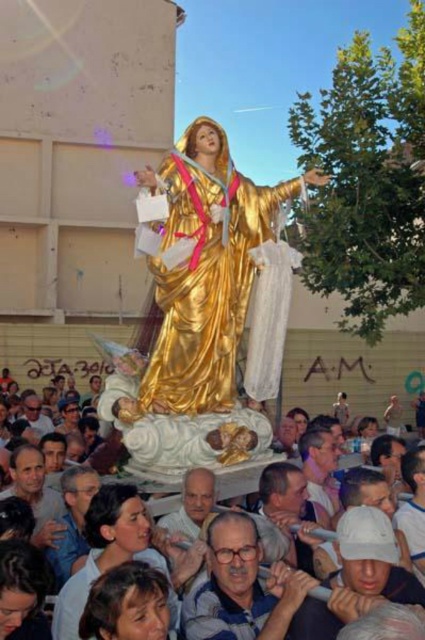
Can you confirm if white matte baseball cap at center is shorter than smooth skin face at lower left?

In fact, white matte baseball cap at center may be taller than smooth skin face at lower left.

Is white matte baseball cap at center above smooth skin face at lower left?

No, white matte baseball cap at center is not above smooth skin face at lower left.

Who is more forward, (371, 525) or (45, 490)?

Positioned in front is point (371, 525).

Where is `white matte baseball cap at center`? Image resolution: width=425 pixels, height=640 pixels. white matte baseball cap at center is located at coordinates (357, 576).

Is point (195, 616) positioned before point (42, 522)?

Yes, it is.

Can you confirm if matte blue shirt at center is positioned to the right of smooth skin face at lower left?

Indeed, matte blue shirt at center is positioned on the right side of smooth skin face at lower left.

Is point (248, 522) positioned behind point (34, 458)?

That is False.

Where is `matte blue shirt at center`? This screenshot has height=640, width=425. matte blue shirt at center is located at coordinates (240, 588).

Based on the photo, between gold polished statue at center and smooth skin face at lower left, which one appears on the right side from the viewer's perspective?

gold polished statue at center is more to the right.

Which is in front, point (206, 241) or point (42, 508)?

Point (42, 508) is more forward.

Identify the location of gold polished statue at center. The width and height of the screenshot is (425, 640). (x=198, y=308).